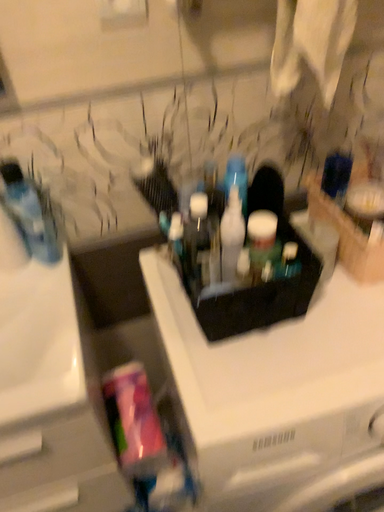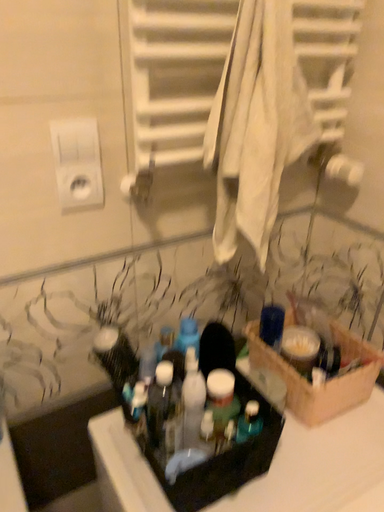
Question: How did the camera likely rotate when shooting the video?

Choices:
 (A) rotated upward
 (B) rotated downward

Answer: (A)